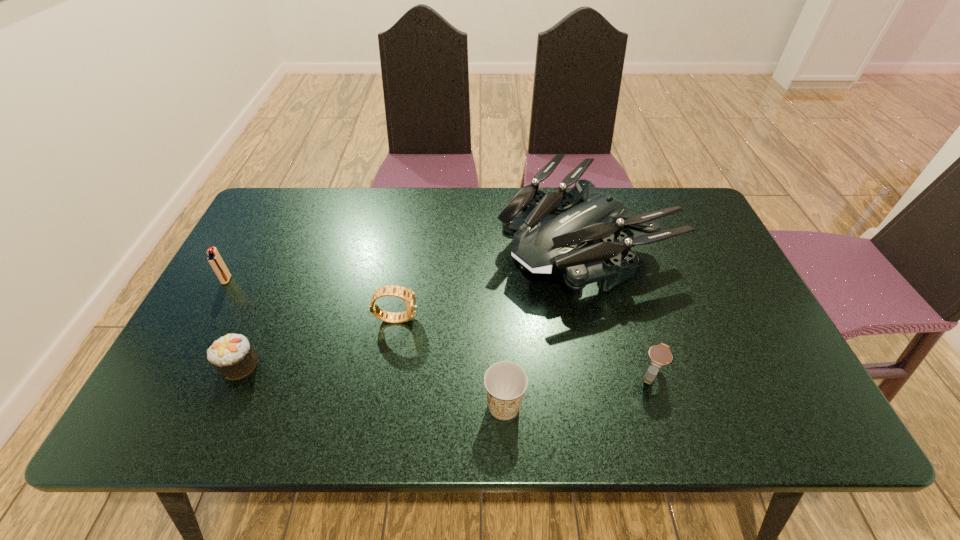
Where is `free spot located on the face of the farther watch`? The width and height of the screenshot is (960, 540). free spot located on the face of the farther watch is located at coordinates (477, 318).

This screenshot has width=960, height=540. In order to click on vacant space located 0.100m on the right of the Dixie cup in this screenshot , I will do `click(572, 406)`.

Where is `free spot located on the right of the fifth object from right to left`? The height and width of the screenshot is (540, 960). free spot located on the right of the fifth object from right to left is located at coordinates (338, 365).

Image resolution: width=960 pixels, height=540 pixels. In order to click on free space located on the left of the nearer watch in this screenshot , I will do `click(495, 376)`.

Locate an element on the screen. The height and width of the screenshot is (540, 960). object that is at the far edge is located at coordinates coord(550,232).

Locate an element on the screen. This screenshot has height=540, width=960. object that is positioned at the near edge is located at coordinates (505, 382).

Find the location of a particular element. igniter that is at the left edge is located at coordinates (216, 262).

Image resolution: width=960 pixels, height=540 pixels. I want to click on cupcake located at the left edge, so click(232, 355).

This screenshot has height=540, width=960. In order to click on object at the right edge in this screenshot , I will do `click(550, 232)`.

I want to click on object at the far right corner, so click(x=550, y=232).